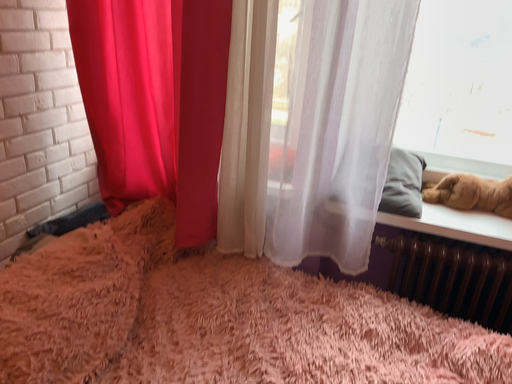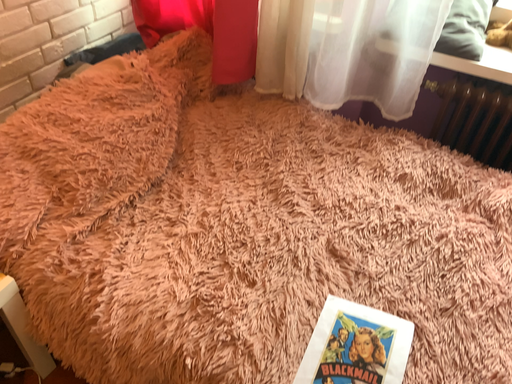
Question: How did the camera likely rotate when shooting the video?

Choices:
 (A) rotated downward
 (B) rotated upward

Answer: (A)